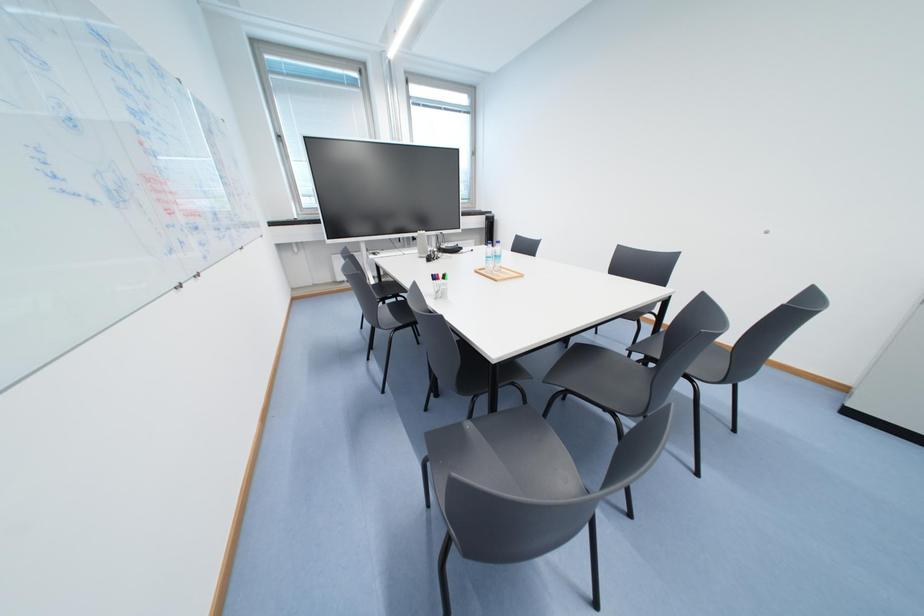
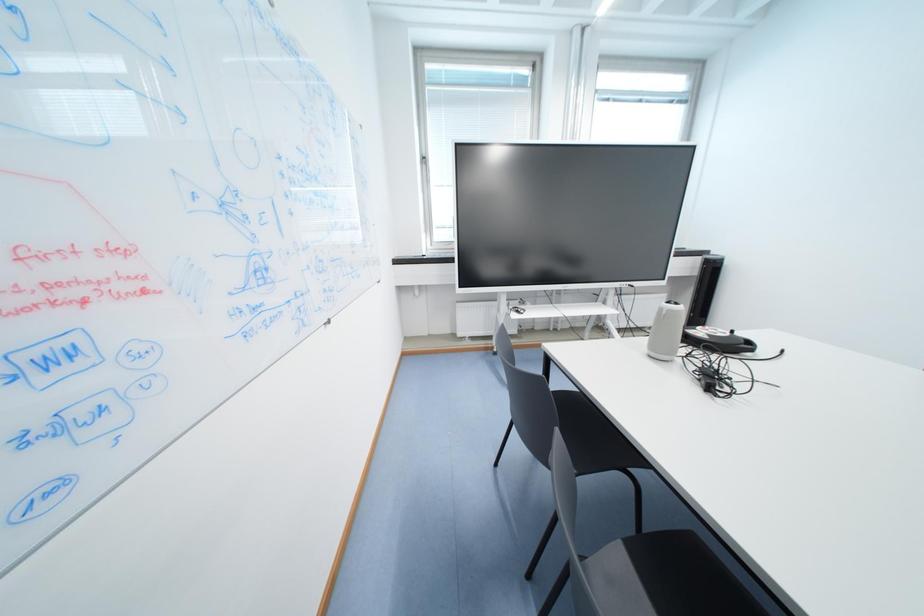
Looking at this image, in a continuous first-person perspective shot, in which direction is the camera moving?

The cameraman walked toward left, forward.